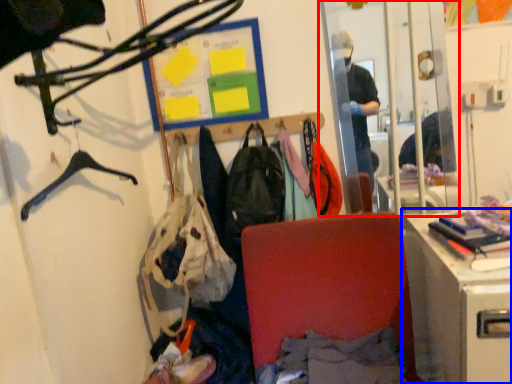
Question: Which object appears farthest to the camera in this image, mirror (highlighted by a red box) or desk (highlighted by a blue box)?

Choices:
 (A) mirror
 (B) desk

Answer: (A)